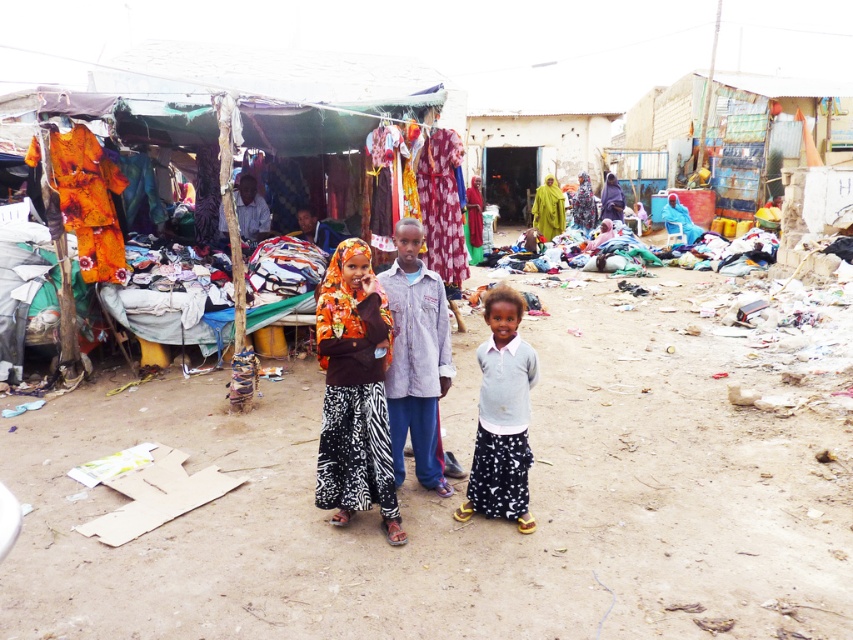
You are a customer at the market and want to buy both the light gray cotton shirt at center and the floral fabric dress at center. Which item is positioned higher up on the display?

The floral fabric dress at center is positioned higher up because the light gray cotton shirt at center is located below it.

You are a customer at the market and want to buy the light gray cotton shirt at center and the purple matte hijab at center. Which item would you need to reach for first if you want to grab both items in order from closest to farthest?

The light gray cotton shirt at center is closer to the viewer than the purple matte hijab at center, so you should reach for the light gray cotton shirt at center first.

You are a customer at the market and want to buy both the light gray cotton shirt at center and the floral fabric dress at center. Which item would you need a larger bag for?

The floral fabric dress at center requires a larger bag because it is bigger than the light gray cotton shirt at center.